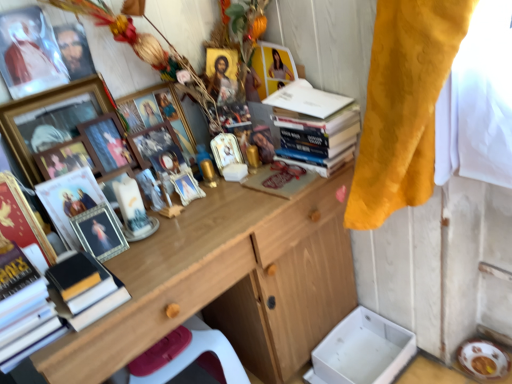
Where is `vacant area that lies to the right of silver metallic picture frame at center-left, the 5th picture frame when ordered from left to right`? This screenshot has width=512, height=384. vacant area that lies to the right of silver metallic picture frame at center-left, the 5th picture frame when ordered from left to right is located at coordinates (167, 256).